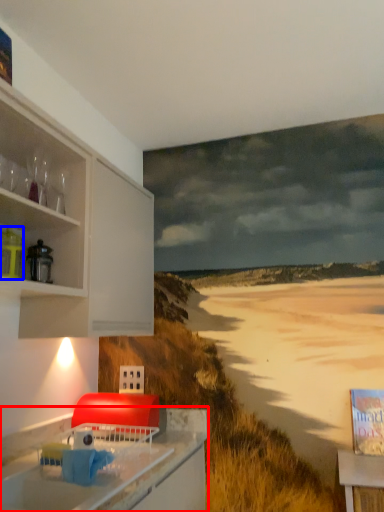
Question: Which of the following is the farthest to the observer, countertop (highlighted by a red box) or appliance (highlighted by a blue box)?

Choices:
 (A) countertop
 (B) appliance

Answer: (B)